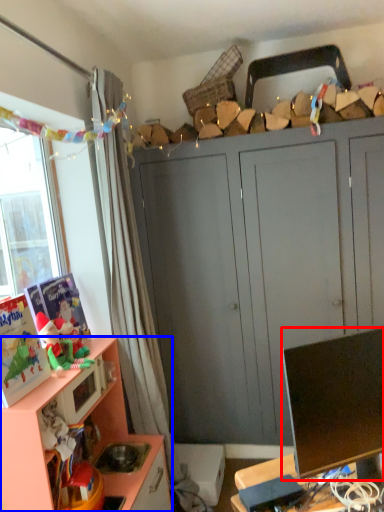
Question: Which object appears farthest to the camera in this image, television (highlighted by a red box) or cabinetry (highlighted by a blue box)?

Choices:
 (A) television
 (B) cabinetry

Answer: (B)